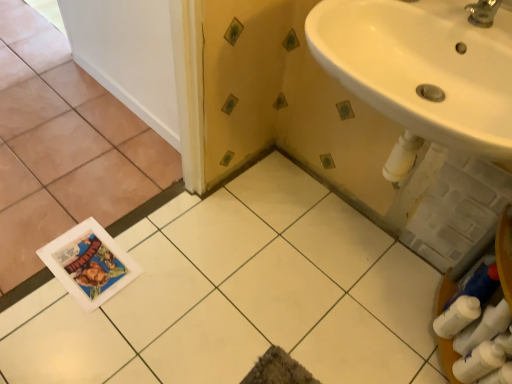
This screenshot has height=384, width=512. Find the location of `blank space to the left of white matte toilet paper at lower right`. blank space to the left of white matte toilet paper at lower right is located at coordinates (388, 327).